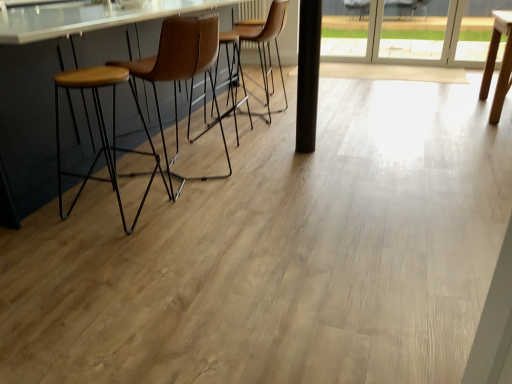
Describe the element at coordinates (87, 18) in the screenshot. The width and height of the screenshot is (512, 384). I see `matte wood counter at left` at that location.

At what (x,y) coordinates should I click in order to perform the action: click on brown leather chair at center, the 1th chair from the back. Please return your answer as a coordinate pair (x, y). The height and width of the screenshot is (384, 512). Looking at the image, I should click on (259, 57).

From the image's perspective, is black matte pole at center under matte wood counter at left?

Yes, from the image's perspective, black matte pole at center is below matte wood counter at left.

Which of these two, black matte pole at center or matte wood counter at left, stands shorter?

Standing shorter between the two is matte wood counter at left.

Are black matte pole at center and matte wood counter at left far apart?

Absolutely, black matte pole at center is distant from matte wood counter at left.

Is wooden seat stool at left beside black matte pole at center?

No, wooden seat stool at left is not with black matte pole at center.

Does wooden seat stool at left lie in front of black matte pole at center?

That is True.

From a real-world perspective, is wooden seat stool at left below black matte pole at center?

Indeed, from a real-world perspective, wooden seat stool at left is positioned beneath black matte pole at center.

Does wooden seat stool at left turn towards black matte pole at center?

No, wooden seat stool at left is not facing towards black matte pole at center.

From the image's perspective, is transparent glass window at upper right, the 1th window viewed from the right, on top of matte wood counter at left?

Yes, from the image's perspective, transparent glass window at upper right, the 1th window viewed from the right, is over matte wood counter at left.

Is transparent glass window at upper right, which is counted as the second window, starting from the left, looking in the opposite direction of matte wood counter at left?

No, transparent glass window at upper right, which is counted as the second window, starting from the left, is not facing away from matte wood counter at left.

Which object is positioned more to the right, transparent glass window at upper right, which is counted as the second window, starting from the left, or matte wood counter at left?

transparent glass window at upper right, which is counted as the second window, starting from the left.

Who is taller, transparent glass window at upper right, which is counted as the second window, starting from the left, or matte wood counter at left?

Standing taller between the two is matte wood counter at left.

In order to click on the 1st window behind the brown leather chair at center, which is the second chair in front-to-back order in this screenshot , I will do `click(477, 28)`.

From the picture: Is brown leather chair at center, the 1th chair from the back, not within transparent glass window at upper right, the 1th window viewed from the right?

Absolutely, brown leather chair at center, the 1th chair from the back, is external to transparent glass window at upper right, the 1th window viewed from the right.

Is brown leather chair at center, which is the second chair in front-to-back order, further to the viewer compared to transparent glass window at upper right, which is counted as the second window, starting from the left?

No, brown leather chair at center, which is the second chair in front-to-back order, is closer to the camera.

In the scene shown: Is black matte pole at center inside brown leather chair at center, which is the second chair in front-to-back order?

No, black matte pole at center is not surrounded by brown leather chair at center, which is the second chair in front-to-back order.

Considering the sizes of brown leather chair at center, the 1th chair from the back, and black matte pole at center in the image, is brown leather chair at center, the 1th chair from the back, wider or thinner than black matte pole at center?

In the image, brown leather chair at center, the 1th chair from the back, appears to be wider than black matte pole at center.

From a real-world perspective, is brown leather chair at center, which is the second chair in front-to-back order, positioned over black matte pole at center based on gravity?

Incorrect, from a real-world perspective, brown leather chair at center, which is the second chair in front-to-back order, is lower than black matte pole at center.

Is brown leather chair at center, the 1th chair from the back, in contact with black matte pole at center?

They are not placed beside each other.

From a real-world perspective, relative to transparent glass window at upper right, which is counted as the second window, starting from the left, is transparent glass door at upper right, which appears as the second window when viewed from the right, vertically above or below?

transparent glass door at upper right, which appears as the second window when viewed from the right, is situated higher than transparent glass window at upper right, which is counted as the second window, starting from the left, in the real world.

Does point (331, 27) appear closer or farther from the camera than point (510, 11)?

Point (331, 27).

In the scene shown: Can you confirm if transparent glass door at upper right, which appears as the second window when viewed from the right, is positioned to the left of transparent glass window at upper right, which is counted as the second window, starting from the left?

Yes, transparent glass door at upper right, which appears as the second window when viewed from the right, is to the left of transparent glass window at upper right, which is counted as the second window, starting from the left.

Does transparent glass door at upper right, which appears as the second window when viewed from the right, have a smaller size compared to transparent glass window at upper right, the 1th window viewed from the right?

Incorrect, transparent glass door at upper right, which appears as the second window when viewed from the right, is not smaller in size than transparent glass window at upper right, the 1th window viewed from the right.

Is matte wood counter at left situated inside brown leather stool at left, the first chair when ordered from front to back, or outside?

matte wood counter at left is located beyond the bounds of brown leather stool at left, the first chair when ordered from front to back.

Find the location of a particular element. This screenshot has width=512, height=384. counter above the brown leather stool at left, the second chair viewed from the back (from a real-world perspective) is located at coordinates (87, 18).

Considering the sizes of matte wood counter at left and brown leather stool at left, the first chair when ordered from front to back, in the image, is matte wood counter at left wider or thinner than brown leather stool at left, the first chair when ordered from front to back,?

In the image, matte wood counter at left appears to be wider than brown leather stool at left, the first chair when ordered from front to back.

Which point is more distant from viewer, [10,22] or [215,21]?

The point [215,21] is farther.

In order to click on pillar located below the matte wood counter at left (from the image's perspective) in this screenshot , I will do `click(308, 74)`.

Locate an element on the screen. The height and width of the screenshot is (384, 512). pillar above the wooden seat stool at left (from the image's perspective) is located at coordinates (308, 74).

Based on their spatial positions, is transparent glass door at upper right, which is counted as the 1th window, starting from the left, or black matte pole at center further from brown leather stool at left, the second chair viewed from the back?

Among the two, transparent glass door at upper right, which is counted as the 1th window, starting from the left, is located further to brown leather stool at left, the second chair viewed from the back.

From the image, which object appears to be nearer to wooden seat stool at left, brown leather chair at center, the 1th chair from the back, or brown leather stool at left, the first chair when ordered from front to back?

brown leather stool at left, the first chair when ordered from front to back, is closer to wooden seat stool at left.

Which object lies further to the anchor point wooden seat stool at left, matte wood counter at left or transparent glass screen door at upper right?

transparent glass screen door at upper right is positioned further to the anchor wooden seat stool at left.

When comparing their distances from transparent glass screen door at upper right, does matte wood counter at left or wooden seat stool at left seem closer?

Among the two, matte wood counter at left is located nearer to transparent glass screen door at upper right.

Estimate the real-world distances between objects in this image. Which object is closer to wooden seat stool at left, black matte pole at center or transparent glass window at upper right, which is counted as the second window, starting from the left?

black matte pole at center lies closer to wooden seat stool at left than the other object.

Based on their spatial positions, is transparent glass screen door at upper right or brown leather chair at center, the 1th chair from the back, further from wooden seat stool at left?

transparent glass screen door at upper right lies further to wooden seat stool at left than the other object.

When comparing their distances from brown leather stool at left, the second chair viewed from the back, does brown leather chair at center, which is the second chair in front-to-back order, or matte wood counter at left seem further?

brown leather chair at center, which is the second chair in front-to-back order, is further to brown leather stool at left, the second chair viewed from the back.

In the scene shown: Considering their positions, is brown leather chair at center, the 1th chair from the back, positioned closer to transparent glass window at upper right, the 1th window viewed from the right, than black matte pole at center?

brown leather chair at center, the 1th chair from the back, is positioned closer to the anchor transparent glass window at upper right, the 1th window viewed from the right.

This screenshot has height=384, width=512. Find the location of `pillar situated between matte wood counter at left and transparent glass window at upper right, which is counted as the second window, starting from the left, from left to right`. pillar situated between matte wood counter at left and transparent glass window at upper right, which is counted as the second window, starting from the left, from left to right is located at coordinates (308, 74).

Identify the location of window positioned between black matte pole at center and transparent glass door at upper right, which is counted as the 1th window, starting from the left, from near to far. (477, 28).

The image size is (512, 384). What are the coordinates of `pillar between wooden seat stool at left and transparent glass screen door at upper right from front to back` in the screenshot? It's located at (308, 74).

Identify the location of pillar located between brown leather stool at left, the first chair when ordered from front to back, and transparent glass window at upper right, the 1th window viewed from the right, in the left-right direction. (308, 74).